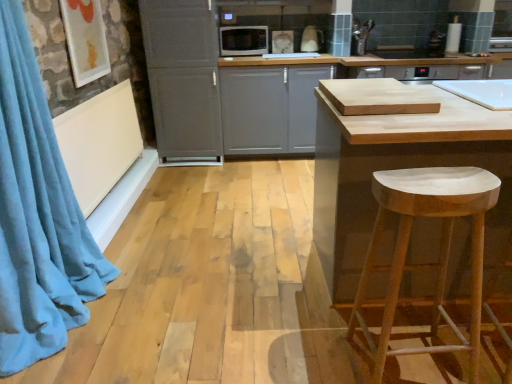
In order to face white matte cabinet at center, which is counted as the 1th cabinetry, starting from the right, should I rotate leftwards or rightwards?

Turn right approximately 2.965 degrees to face it.

What do you see at coordinates (426, 263) in the screenshot? I see `white matte stool at lower right` at bounding box center [426, 263].

The width and height of the screenshot is (512, 384). Describe the element at coordinates (395, 164) in the screenshot. I see `natural wood cutting board at center` at that location.

Describe the element at coordinates (243, 40) in the screenshot. I see `white glossy microwave at upper center, the first appliance from the left` at that location.

In order to click on white matte cabinet at center, which is counted as the 1th cabinetry, starting from the right in this screenshot , I will do `click(270, 108)`.

Is white glossy microwave at upper center, which is counted as the 2th appliance, starting from the right, far from white matte cabinet at center, which is counted as the second cabinetry, starting from the left?

No, there isn't a large distance between white glossy microwave at upper center, which is counted as the 2th appliance, starting from the right, and white matte cabinet at center, which is counted as the second cabinetry, starting from the left.

Is white glossy microwave at upper center, the first appliance from the left, thinner than white matte cabinet at center, which is counted as the second cabinetry, starting from the left?

Yes, white glossy microwave at upper center, the first appliance from the left, is thinner than white matte cabinet at center, which is counted as the second cabinetry, starting from the left.

How far apart are white glossy microwave at upper center, the first appliance from the left, and white matte cabinet at center, which is counted as the 1th cabinetry, starting from the right?

The distance of white glossy microwave at upper center, the first appliance from the left, from white matte cabinet at center, which is counted as the 1th cabinetry, starting from the right, is 26.44 inches.

From the image's perspective, is white glossy microwave at upper center, the first appliance from the left, positioned above or below white matte cabinet at center, which is counted as the 1th cabinetry, starting from the right?

Clearly, from the image's perspective, white glossy microwave at upper center, the first appliance from the left, is above white matte cabinet at center, which is counted as the 1th cabinetry, starting from the right.

Does white matte stool at lower right have a lesser height compared to white glossy microwave at upper center, which is counted as the 2th appliance, starting from the right?

In fact, white matte stool at lower right may be taller than white glossy microwave at upper center, which is counted as the 2th appliance, starting from the right.

Does white matte stool at lower right turn towards white glossy microwave at upper center, which is counted as the 2th appliance, starting from the right?

Yes, white matte stool at lower right faces towards white glossy microwave at upper center, which is counted as the 2th appliance, starting from the right.

Is white matte stool at lower right completely or partially outside of white glossy microwave at upper center, the first appliance from the left?

Yes.

From the image's perspective, is white matte stool at lower right below white glossy microwave at upper center, the first appliance from the left?

Indeed, from the image's perspective, white matte stool at lower right is shown beneath white glossy microwave at upper center, the first appliance from the left.

Would you say matte gray cabinet at center, the first cabinetry from the left, is to the left or to the right of white glossy toaster at upper center, which appears as the 1th appliance when viewed from the right, in the picture?

Clearly, matte gray cabinet at center, the first cabinetry from the left, is on the left of white glossy toaster at upper center, which appears as the 1th appliance when viewed from the right, in the image.

In the scene shown: From a real-world perspective, is matte gray cabinet at center, the first cabinetry from the left, physically located above or below white glossy toaster at upper center, which appears as the 1th appliance when viewed from the right?

matte gray cabinet at center, the first cabinetry from the left, is situated lower than white glossy toaster at upper center, which appears as the 1th appliance when viewed from the right, in the real world.

This screenshot has width=512, height=384. There is a white glossy toaster at upper center, placed as the 2th appliance when sorted from left to right. In order to click on the 1st cabinetry below it (from a real-world perspective) in this screenshot , I will do `click(183, 77)`.

Which is correct: matte gray cabinet at center, the first cabinetry from the left, is inside white glossy toaster at upper center, which appears as the 1th appliance when viewed from the right, or outside of it?

matte gray cabinet at center, the first cabinetry from the left, is spatially situated outside white glossy toaster at upper center, which appears as the 1th appliance when viewed from the right.

From a real-world perspective, is matte gray cabinet at center, the second cabinetry positioned from the right, located beneath white matte cabinet at center, which is counted as the 1th cabinetry, starting from the right?

No, from a real-world perspective, matte gray cabinet at center, the second cabinetry positioned from the right, is not beneath white matte cabinet at center, which is counted as the 1th cabinetry, starting from the right.

Who is more distant, matte gray cabinet at center, the second cabinetry positioned from the right, or white matte cabinet at center, which is counted as the second cabinetry, starting from the left?

white matte cabinet at center, which is counted as the second cabinetry, starting from the left, is behind.

Can you confirm if matte gray cabinet at center, the first cabinetry from the left, is bigger than white matte cabinet at center, which is counted as the second cabinetry, starting from the left?

No, matte gray cabinet at center, the first cabinetry from the left, is not bigger than white matte cabinet at center, which is counted as the second cabinetry, starting from the left.

From the image's perspective, is matte gray cabinet at center, the first cabinetry from the left, on top of white matte cabinet at center, which is counted as the 1th cabinetry, starting from the right?

Correct, matte gray cabinet at center, the first cabinetry from the left, appears higher than white matte cabinet at center, which is counted as the 1th cabinetry, starting from the right, in the image.

Can you confirm if natural wood cutting board at center is taller than blue velvet curtain at left?

No, natural wood cutting board at center is not taller than blue velvet curtain at left.

Is natural wood cutting board at center oriented towards blue velvet curtain at left?

No, natural wood cutting board at center does not turn towards blue velvet curtain at left.

Is there a large distance between natural wood cutting board at center and blue velvet curtain at left?

Yes, natural wood cutting board at center and blue velvet curtain at left are quite far apart.

Find the location of a particular element. This screenshot has height=384, width=512. countertop below the blue velvet curtain at left (from the image's perspective) is located at coordinates (395, 164).

Which of these two, white matte cabinet at center, which is counted as the 1th cabinetry, starting from the right, or white glossy microwave at upper center, the first appliance from the left, stands shorter?

Standing shorter between the two is white glossy microwave at upper center, the first appliance from the left.

Could you tell me if white matte cabinet at center, which is counted as the second cabinetry, starting from the left, is facing white glossy microwave at upper center, which is counted as the 2th appliance, starting from the right?

No, white matte cabinet at center, which is counted as the second cabinetry, starting from the left, is not facing towards white glossy microwave at upper center, which is counted as the 2th appliance, starting from the right.

Can you see white matte cabinet at center, which is counted as the second cabinetry, starting from the left, touching white glossy microwave at upper center, the first appliance from the left?

No, white matte cabinet at center, which is counted as the second cabinetry, starting from the left, is not touching white glossy microwave at upper center, the first appliance from the left.

Based on the photo, is white matte cabinet at center, which is counted as the second cabinetry, starting from the left, smaller than white glossy microwave at upper center, which is counted as the 2th appliance, starting from the right?

Incorrect, white matte cabinet at center, which is counted as the second cabinetry, starting from the left, is not smaller in size than white glossy microwave at upper center, which is counted as the 2th appliance, starting from the right.

Based on their positions, is blue velvet curtain at left located to the left or right of white glossy toaster at upper center, placed as the 2th appliance when sorted from left to right?

In the image, blue velvet curtain at left appears on the left side of white glossy toaster at upper center, placed as the 2th appliance when sorted from left to right.

Choose the correct answer: Is blue velvet curtain at left inside white glossy toaster at upper center, placed as the 2th appliance when sorted from left to right, or outside it?

blue velvet curtain at left is not inside white glossy toaster at upper center, placed as the 2th appliance when sorted from left to right, it's outside.

In the scene shown: Is blue velvet curtain at left next to white glossy toaster at upper center, placed as the 2th appliance when sorted from left to right, and touching it?

No, blue velvet curtain at left is not next to white glossy toaster at upper center, placed as the 2th appliance when sorted from left to right.

Considering the points (34, 189) and (313, 32), which point is in front, point (34, 189) or point (313, 32)?

The point (34, 189) is more forward.

You are a GUI agent. You are given a task and a screenshot of the screen. Output one action in this format:
    pyautogui.click(x=<x>, y=<y>)
    Task: Click on the cabinetry on the right of white glossy microwave at upper center, which is counted as the 2th appliance, starting from the right
    The height and width of the screenshot is (384, 512).
    Given the screenshot: What is the action you would take?
    pyautogui.click(x=270, y=108)

In order to click on stool that appears in front of the white glossy microwave at upper center, the first appliance from the left in this screenshot , I will do 426,263.

When comparing their distances from blue velvet curtain at left, does white glossy microwave at upper center, the first appliance from the left, or matte gray cabinet at center, the first cabinetry from the left, seem further?

Among the two, white glossy microwave at upper center, the first appliance from the left, is located further to blue velvet curtain at left.

From the image, which object appears to be farther from natural wood cutting board at center, white glossy toaster at upper center, which appears as the 1th appliance when viewed from the right, or matte gray cabinet at center, the second cabinetry positioned from the right?

Among the two, white glossy toaster at upper center, which appears as the 1th appliance when viewed from the right, is located further to natural wood cutting board at center.

Considering their positions, is natural wood cutting board at center positioned closer to blue velvet curtain at left than white matte stool at lower right?

natural wood cutting board at center.

Which object lies nearer to the anchor point white matte stool at lower right, blue velvet curtain at left or white matte cabinet at center, which is counted as the second cabinetry, starting from the left?

blue velvet curtain at left is positioned closer to the anchor white matte stool at lower right.

Based on their spatial positions, is white glossy toaster at upper center, which appears as the 1th appliance when viewed from the right, or natural wood cutting board at center further from white matte stool at lower right?

white glossy toaster at upper center, which appears as the 1th appliance when viewed from the right, is further to white matte stool at lower right.

From the picture: Based on their spatial positions, is white matte cabinet at center, which is counted as the 1th cabinetry, starting from the right, or white matte stool at lower right further from matte gray cabinet at center, the first cabinetry from the left?

Among the two, white matte stool at lower right is located further to matte gray cabinet at center, the first cabinetry from the left.

Based on the photo, considering their positions, is white glossy toaster at upper center, placed as the 2th appliance when sorted from left to right, positioned further to matte gray cabinet at center, the second cabinetry positioned from the right, than natural wood cutting board at center?

natural wood cutting board at center.

From the image, which object appears to be nearer to white glossy toaster at upper center, placed as the 2th appliance when sorted from left to right, white matte stool at lower right or blue velvet curtain at left?

Based on the image, white matte stool at lower right appears to be nearer to white glossy toaster at upper center, placed as the 2th appliance when sorted from left to right.

Where is `countertop located between blue velvet curtain at left and white glossy microwave at upper center, which is counted as the 2th appliance, starting from the right, in the depth direction`? The height and width of the screenshot is (384, 512). countertop located between blue velvet curtain at left and white glossy microwave at upper center, which is counted as the 2th appliance, starting from the right, in the depth direction is located at coordinates (395, 164).

Where is `appliance between matte gray cabinet at center, the second cabinetry positioned from the right, and white glossy toaster at upper center, which appears as the 1th appliance when viewed from the right, in the horizontal direction`? The width and height of the screenshot is (512, 384). appliance between matte gray cabinet at center, the second cabinetry positioned from the right, and white glossy toaster at upper center, which appears as the 1th appliance when viewed from the right, in the horizontal direction is located at coordinates (243, 40).

The width and height of the screenshot is (512, 384). What are the coordinates of `countertop between white matte stool at lower right and white glossy microwave at upper center, which is counted as the 2th appliance, starting from the right, in the front-back direction` in the screenshot? It's located at (395, 164).

Find the location of `appliance positioned between white matte stool at lower right and white glossy toaster at upper center, which appears as the 1th appliance when viewed from the right, from near to far`. appliance positioned between white matte stool at lower right and white glossy toaster at upper center, which appears as the 1th appliance when viewed from the right, from near to far is located at coordinates (243, 40).